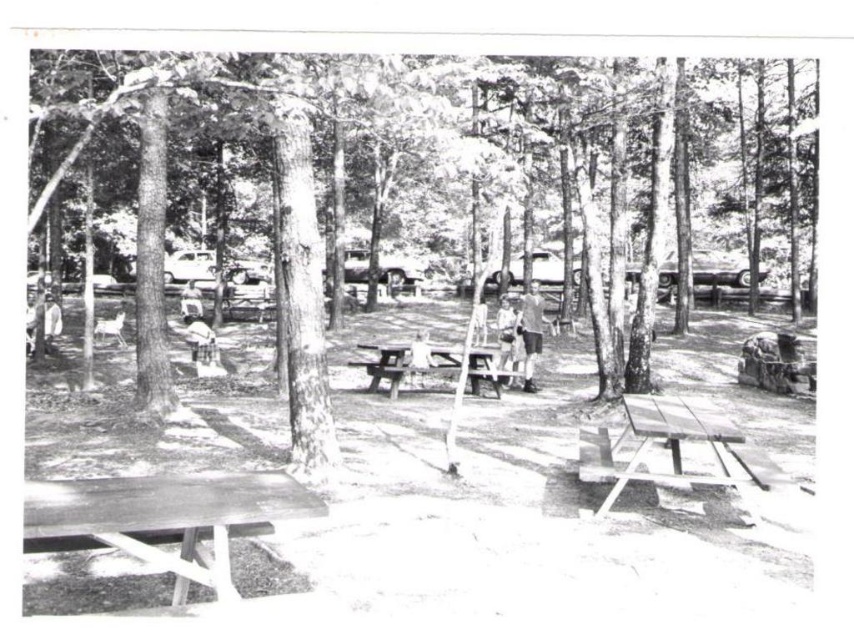
You are standing in the picnic area and want to take a photo of both the smooth bark tree at center and the light brown fabric shirt at center. Which object should you focus on first to ensure both are in clear view?

You should focus on the smooth bark tree at center first since it is closer to you than the light brown fabric shirt at center, ensuring both will be in clear view when focused properly.

You are standing at the picnic area and want to find the smooth bark tree at center. Which direction should you look relative to the light brown fabric shirt at center?

The smooth bark tree at center is to the right of the light brown fabric shirt at center, so you should look to the right of the light brown fabric shirt at center to find it.